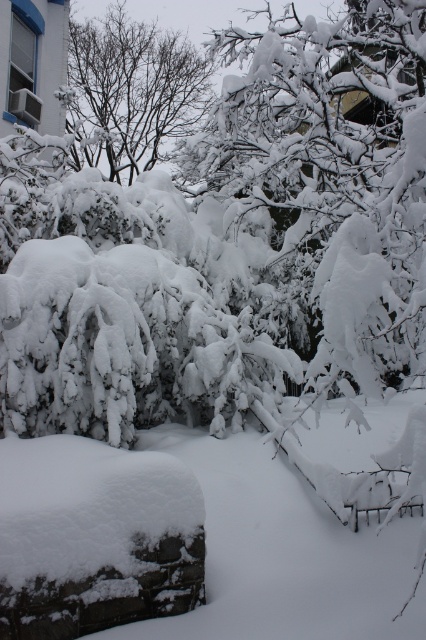
Question: Does white fluffy snow at center come behind snow-covered branches at upper center?

Choices:
 (A) yes
 (B) no

Answer: (B)

Question: Among these points, which one is nearest to the camera?

Choices:
 (A) (94, 49)
 (B) (252, 524)

Answer: (B)

Question: Which point appears farthest from the camera in this image?

Choices:
 (A) (336, 577)
 (B) (161, 38)

Answer: (B)

Question: Does white fluffy snow at center appear over snow-covered branches at upper center?

Choices:
 (A) yes
 (B) no

Answer: (B)

Question: Which object is closer to the camera taking this photo?

Choices:
 (A) snow-covered branches at upper center
 (B) white fluffy snow at center

Answer: (B)

Question: Can you confirm if white fluffy snow at center is thinner than snow-covered branches at upper center?

Choices:
 (A) yes
 (B) no

Answer: (B)